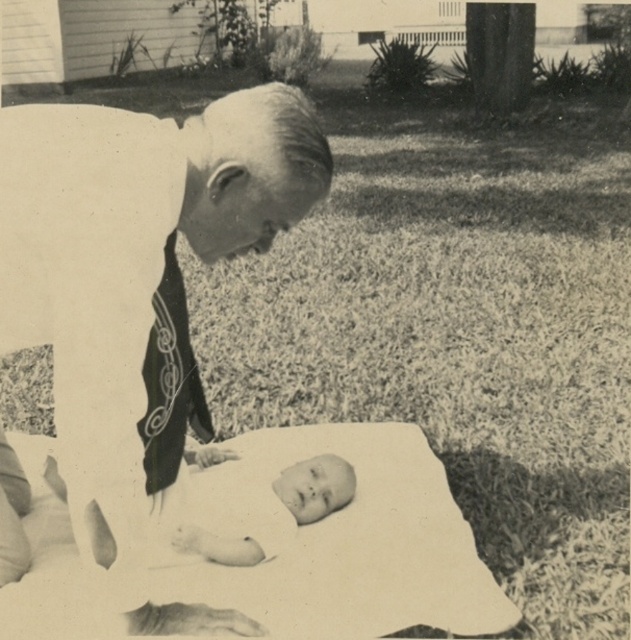
You are a photographer trying to capture a closeup of the smooth white baby at center without including the white cloth at upper left in the frame. Given their sizes, is this possible?

The white cloth at upper left is wider than the smooth white baby at center, so it might be challenging to frame the baby without including the cloth if they are positioned closely together. Adjusting the camera angle or moving closer could help isolate the baby.

In the scene described, there is a man in formal attire leaning over a flat surface with a baby lying on its back. The coordinates point to a specific location. Can you identify what is located at the coordinates point [138,298]?

The point [138,298] indicates the location of the white cloth at upper left.